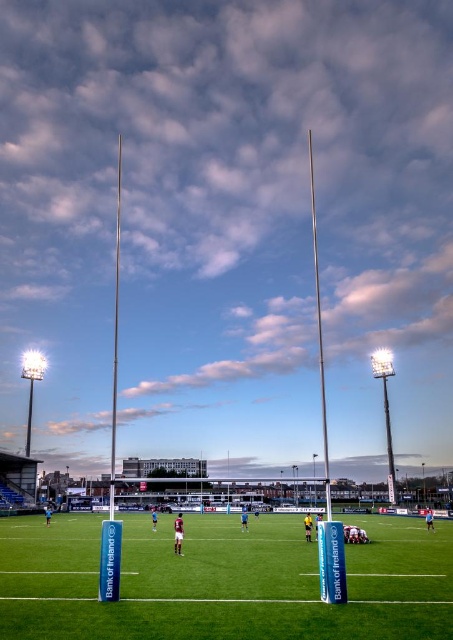
Question: From the image, what is the correct spatial relationship of green grass field at center in relation to polished silver pole at center?

Choices:
 (A) below
 (B) above

Answer: (A)

Question: Which of the following is the farthest from the observer?

Choices:
 (A) polished silver pole at center
 (B) silver metallic pole at left

Answer: (A)

Question: Does green grass field at center have a greater width compared to silver metallic pole at left?

Choices:
 (A) yes
 (B) no

Answer: (A)

Question: Is green grass field at center thinner than silver metallic pole at left?

Choices:
 (A) yes
 (B) no

Answer: (B)

Question: Which point is farther from the camera taking this photo?

Choices:
 (A) (116, 240)
 (B) (292, 531)
 (C) (308, 147)

Answer: (C)

Question: Based on their relative distances, which object is farther from the polished silver pole at center?

Choices:
 (A) silver metallic pole at left
 (B) green grass field at center

Answer: (A)